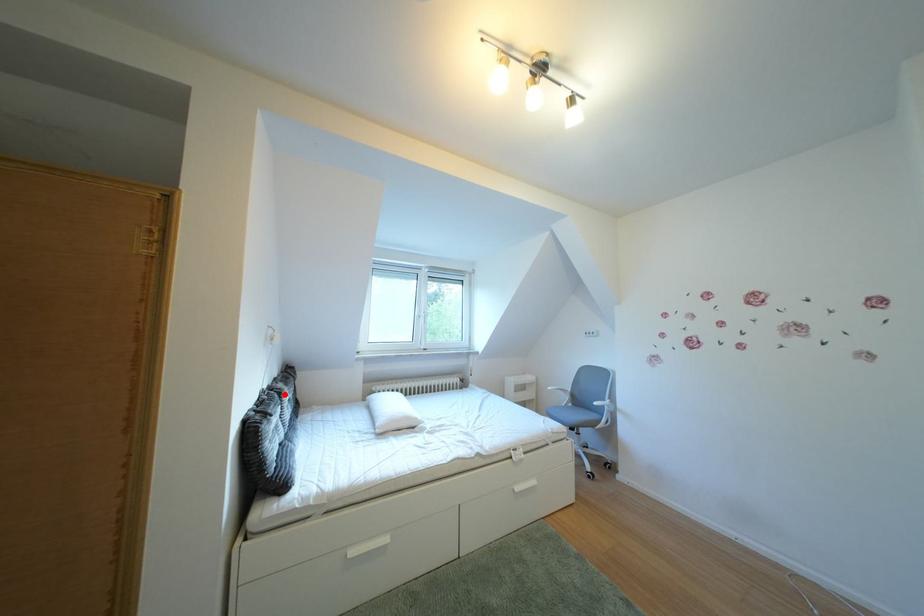
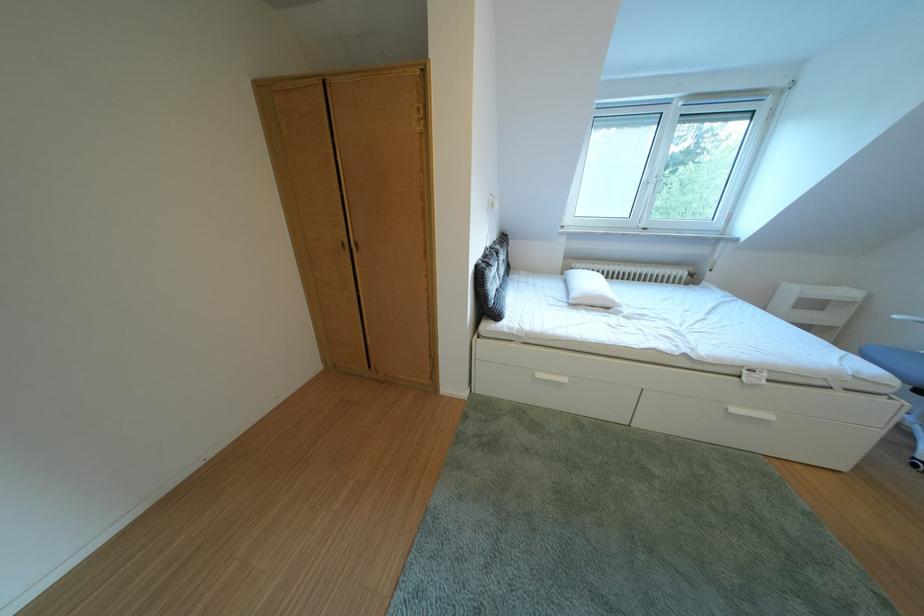
In the second image, find the point that corresponds to the highlighted location in the first image.

(505, 254)